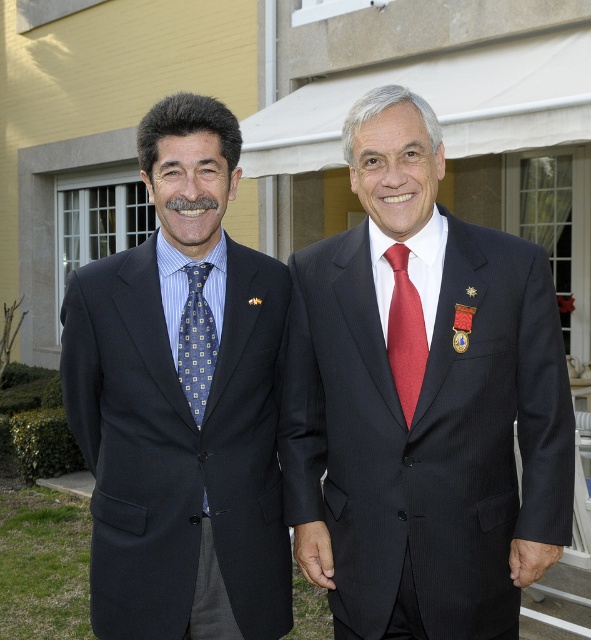
Question: Does dark pinstripe suit at center appear on the left side of blue patterned tie at left?

Choices:
 (A) no
 (B) yes

Answer: (A)

Question: Does dark pinstripe suit at center have a smaller size compared to shiny red tie at center?

Choices:
 (A) no
 (B) yes

Answer: (A)

Question: Which point is farther to the camera?

Choices:
 (A) shiny red tie at center
 (B) dark pinstripe suit at center
 (C) blue patterned tie at left

Answer: (C)

Question: Which is farther from the blue patterned tie at left?

Choices:
 (A) dark pinstripe suit at center
 (B) blue textured suit at left
 (C) shiny red tie at center

Answer: (C)

Question: Which point is farther to the camera?

Choices:
 (A) (163, 376)
 (B) (196, 298)
 (C) (394, 317)

Answer: (B)

Question: Does blue textured suit at left appear under blue patterned tie at left?

Choices:
 (A) no
 (B) yes

Answer: (B)